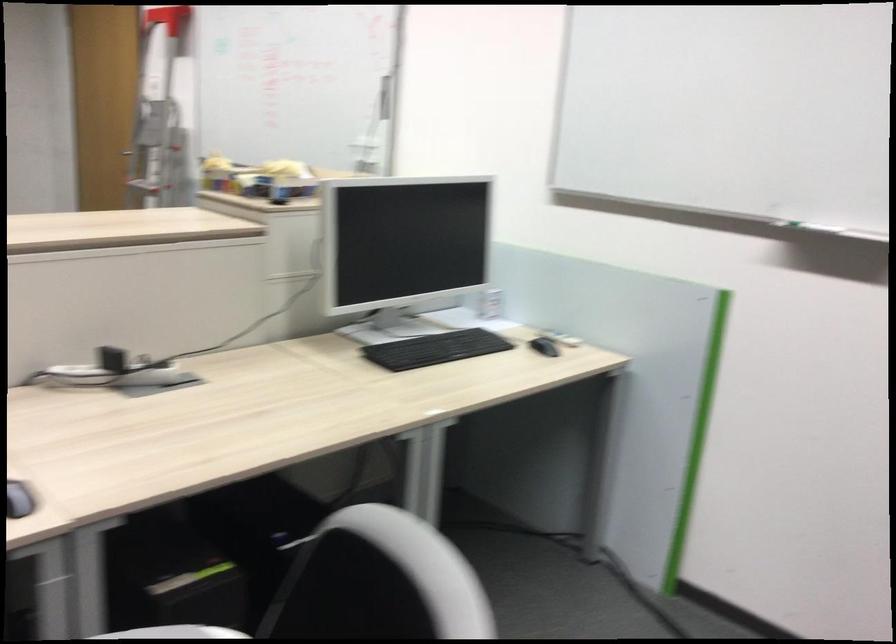
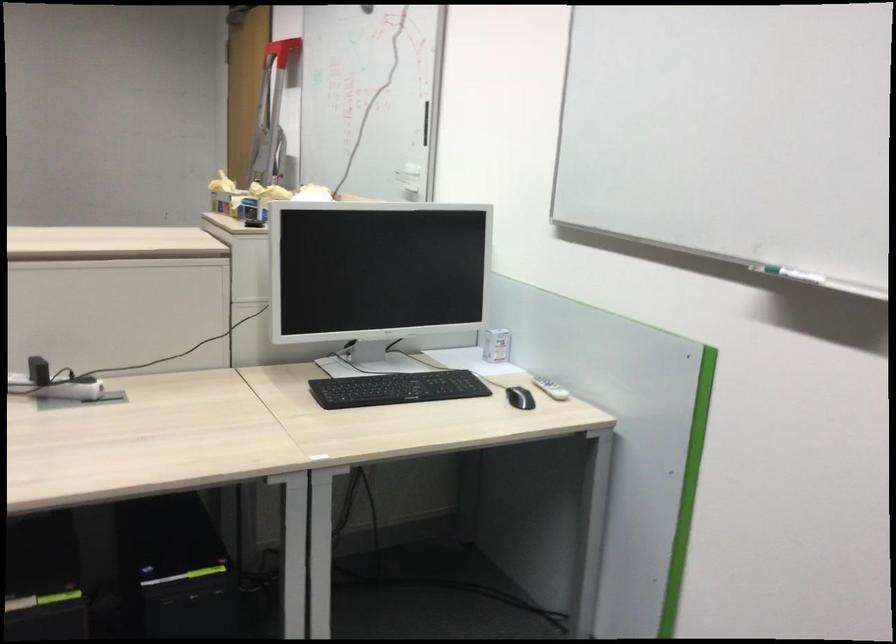
Where in the second image is the point corresponding to point (554, 348) from the first image?

(520, 398)